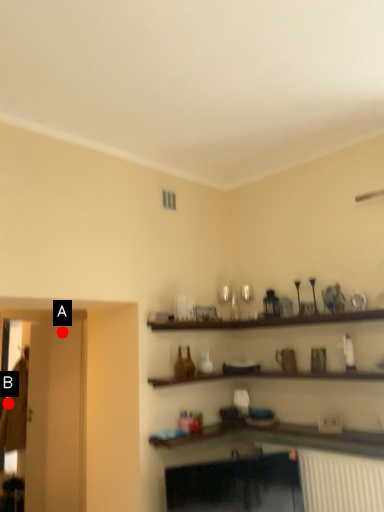
Question: Two points are circled on the image, labeled by A and B beside each circle. Which point appears closest to the camera in this image?

Choices:
 (A) A is closer
 (B) B is closer

Answer: (A)